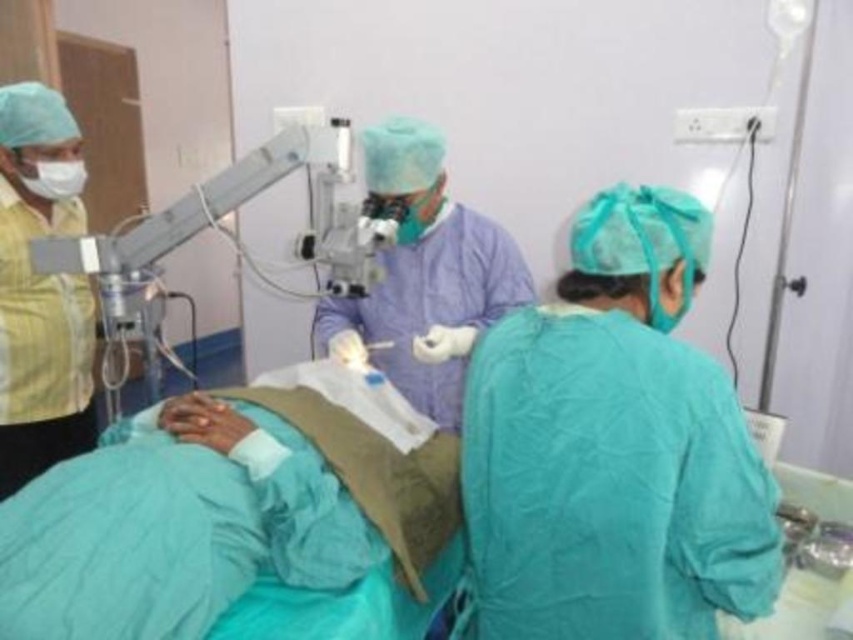
Question: Can you confirm if metallic microscope at upper center is bigger than white matte mask at upper left?

Choices:
 (A) yes
 (B) no

Answer: (A)

Question: Does purple smooth surgical gown at center have a greater width compared to yellow cotton shirt at left?

Choices:
 (A) yes
 (B) no

Answer: (A)

Question: Based on their relative distances, which object is nearer to the white matte mask at upper left?

Choices:
 (A) purple smooth surgical gown at center
 (B) yellow cotton shirt at left
 (C) green surgical gown at center
 (D) metallic microscope at upper center

Answer: (B)

Question: Is green surgical gown at center thinner than metallic microscope at upper center?

Choices:
 (A) yes
 (B) no

Answer: (A)

Question: Which point is farther to the camera?

Choices:
 (A) white matte mask at upper left
 (B) yellow cotton shirt at left
 (C) green surgical gown at center

Answer: (A)

Question: Considering the real-world distances, which object is closest to the yellow cotton shirt at left?

Choices:
 (A) metallic microscope at upper center
 (B) white matte mask at upper left
 (C) green surgical gown at center
 (D) purple smooth surgical gown at center

Answer: (B)